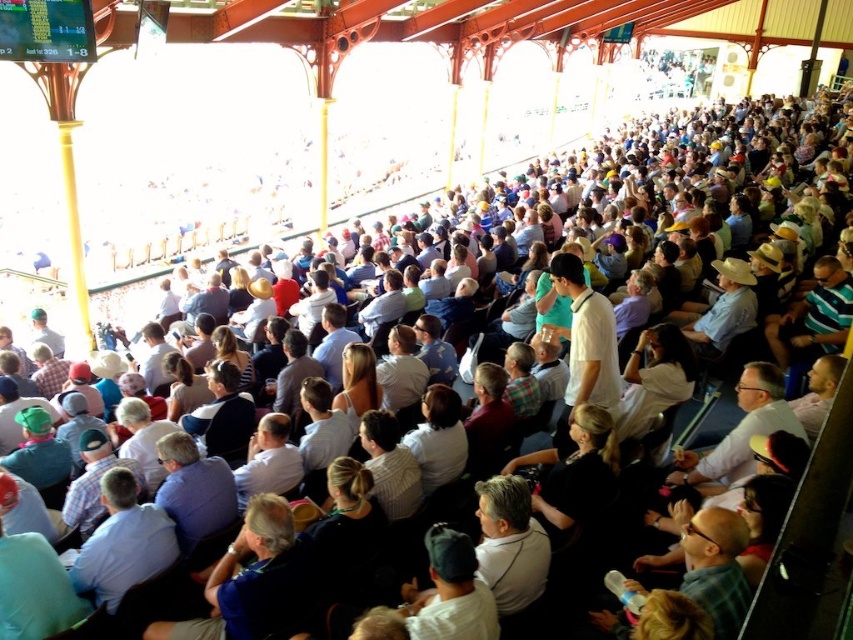
Locate an element on the screen. This screenshot has height=640, width=853. blue shirt at center is located at coordinates (193, 490).

Can you confirm if blue shirt at center is taller than white shirt at center?

Yes.

At what (x,y) coordinates should I click in order to perform the action: click on blue shirt at center. Please return your answer as a coordinate pair (x, y). Looking at the image, I should click on (193, 490).

Which is below, white shirt at center or light gray shirt at center?

white shirt at center is lower down.

Is white shirt at center above light gray shirt at center?

No, white shirt at center is not above light gray shirt at center.

Is point (262, 428) in front of point (393, 344)?

Yes, point (262, 428) is closer to viewer.

This screenshot has width=853, height=640. What are the coordinates of `white shirt at center` in the screenshot? It's located at (268, 460).

Between light blue shirt at center and white shirt at center, which one has more height?

light blue shirt at center is taller.

Does light blue shirt at center come in front of white shirt at center?

Yes.

The width and height of the screenshot is (853, 640). What do you see at coordinates (123, 541) in the screenshot?
I see `light blue shirt at center` at bounding box center [123, 541].

Locate an element on the screen. The width and height of the screenshot is (853, 640). light blue shirt at center is located at coordinates (123, 541).